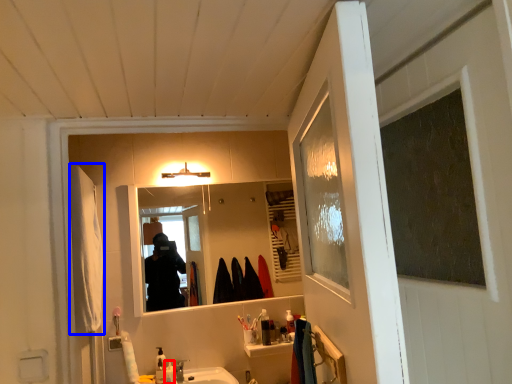
Question: Among these objects, which one is nearest to the camera, toiletry (highlighted by a red box) or robe (highlighted by a blue box)?

Choices:
 (A) toiletry
 (B) robe

Answer: (B)